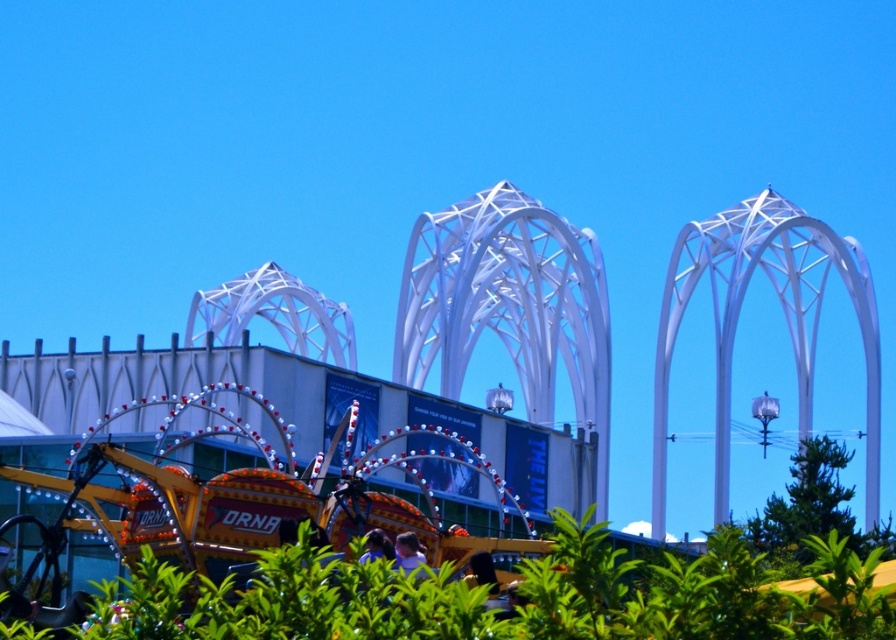
Is point (329, 486) behind point (274, 420)?

No, (329, 486) is in front of (274, 420).

Who is positioned more to the left, metallic amusement ride at center or metallic yellow amusement ride at lower left?

metallic yellow amusement ride at lower left is more to the left.

Which is behind, point (510, 481) or point (85, 440)?

Point (510, 481)

At what (x,y) coordinates should I click in order to perform the action: click on metallic amusement ride at center. Please return your answer as a coordinate pair (x, y). This screenshot has width=896, height=640. Looking at the image, I should click on (364, 460).